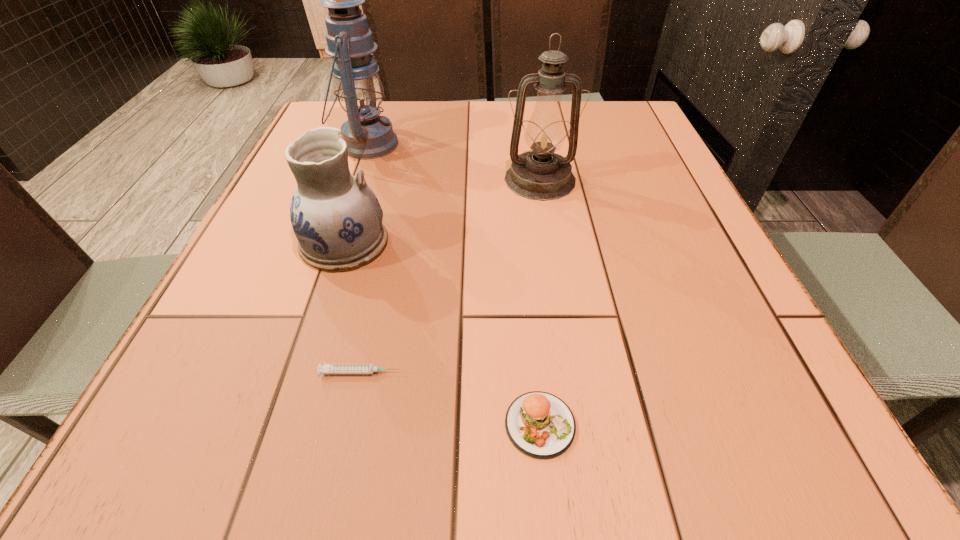
Identify the location of free region located on the back of the pottery. (374, 150).

Find the location of a particular element. vacant space situated 0.280m on the right of the fourth tallest object is located at coordinates (778, 424).

The height and width of the screenshot is (540, 960). What are the coordinates of `vacant space located at the needle end of the shortest object` in the screenshot? It's located at (446, 373).

You are a GUI agent. You are given a task and a screenshot of the screen. Output one action in this format:
    pyautogui.click(x=<x>, y=<y>)
    Task: Click on the object present at the far edge
    This screenshot has height=540, width=960.
    Given the screenshot: What is the action you would take?
    pyautogui.click(x=360, y=92)

You are a GUI agent. You are given a task and a screenshot of the screen. Output one action in this format:
    pyautogui.click(x=<x>, y=<y>)
    Task: Click on the object positioned at the near edge
    
    Given the screenshot: What is the action you would take?
    pyautogui.click(x=539, y=424)

What are the coordinates of `lantern that is at the left edge` in the screenshot? It's located at (360, 92).

This screenshot has width=960, height=540. Identify the location of pottery at the left edge. (337, 219).

Find the location of a particular element. The width and height of the screenshot is (960, 540). object present at the far left corner is located at coordinates (360, 92).

Identify the location of vacant region at the far edge of the desktop. The image size is (960, 540). (403, 120).

The image size is (960, 540). What are the coordinates of `vacant region at the near edge of the desktop` in the screenshot? It's located at (563, 463).